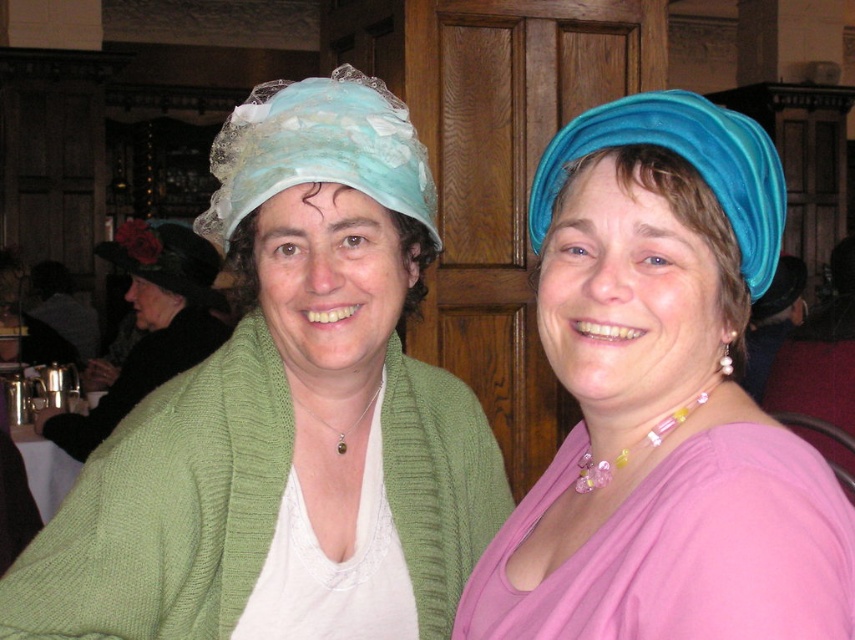
You are a photographer trying to capture a closeup shot of the blue velvet hat at upper right and the pink satin robe at center. Since the camera can only focus on one object at a time, which object should you choose to ensure it fills the frame more effectively?

The blue velvet hat at upper right has a larger size compared to the pink satin robe at center, so choosing it will allow it to fill the frame more effectively.

You are a photographer setting up for a group photo. You notice the blue velvet hat at upper right and the pink satin robe at center. Which object is closer to the camera?

The blue velvet hat at upper right is closer to the camera because it is in front of the pink satin robe at center.

You are a photographer setting up for a portrait shoot. You have a 30 inch wide backdrop that needs to be positioned behind the pink satin robe at center. Will the backdrop be wide enough to cover the robe completely?

The pink satin robe at center is 31.74 inches away from the camera. Since the backdrop is only 30 inches wide, it will not be wide enough to cover the robe completely.